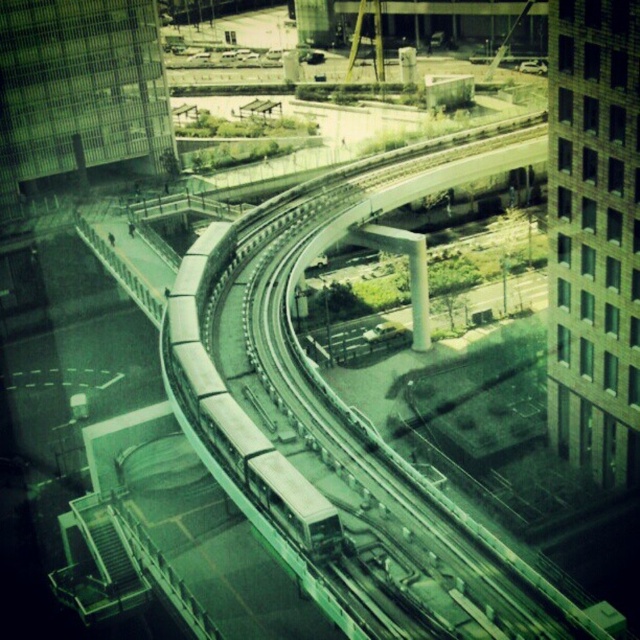
You are a city planner analyzing the urban layout. From your vantage point, which object is closer to you between the green concrete train track at center and the metallic silver train at center?

The green concrete train track at center is closer to you because it is positioned in front of the metallic silver train at center.

Please provide the coordinates of the green concrete train track at center in the image. The coordinate system is defined with the origin at the bottom left corner of the image, and the values range from 0 to 1 in both x and y directions.

The coordinates of the green concrete train track at center are at point 0.653 in the x direction and 0.536 in the y direction.

You are standing at point (225, 426) and want to walk to point (547, 586). Given the urban scene with the monorail track and buildings, can you safely walk directly from your current position to the destination without crossing any obstacles?

Yes, you can safely walk directly from point (225, 426) to point (547, 586) because point (547, 586) is in front of point (225, 426), indicating a clear path between them.